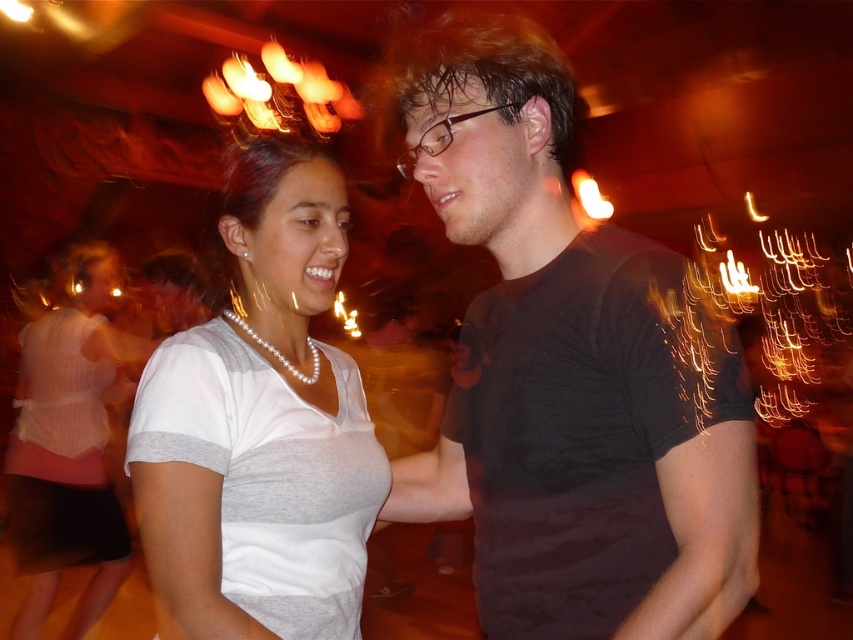
Question: Which of these objects is positioned farthest from the white pearl necklace at center?

Choices:
 (A) pearl necklace at upper left
 (B) black matte shirt at center

Answer: (A)

Question: Does white pearl necklace at center have a larger size compared to pearl necklace at upper left?

Choices:
 (A) no
 (B) yes

Answer: (A)

Question: Which point appears farthest from the camera in this image?

Choices:
 (A) (335, 180)
 (B) (91, 365)

Answer: (B)

Question: Observing the image, what is the correct spatial positioning of black matte shirt at center in reference to pearl necklace at upper left?

Choices:
 (A) below
 (B) above

Answer: (B)

Question: Which object is the farthest from the black matte shirt at center?

Choices:
 (A) pearl necklace at upper left
 (B) white pearl necklace at center

Answer: (A)

Question: Does black matte shirt at center lie behind white pearl necklace at center?

Choices:
 (A) no
 (B) yes

Answer: (A)